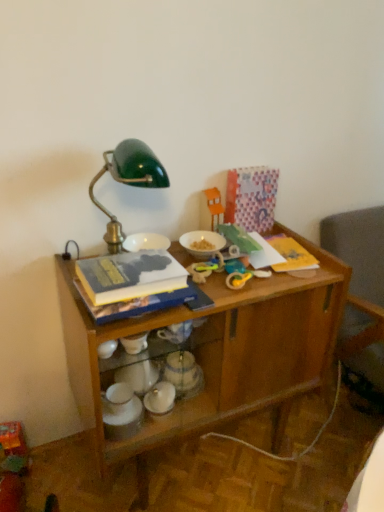
Where is `free space in front of yellow rubber toy at center, acting as the 3th toy starting from the back`? The height and width of the screenshot is (512, 384). free space in front of yellow rubber toy at center, acting as the 3th toy starting from the back is located at coordinates (235, 298).